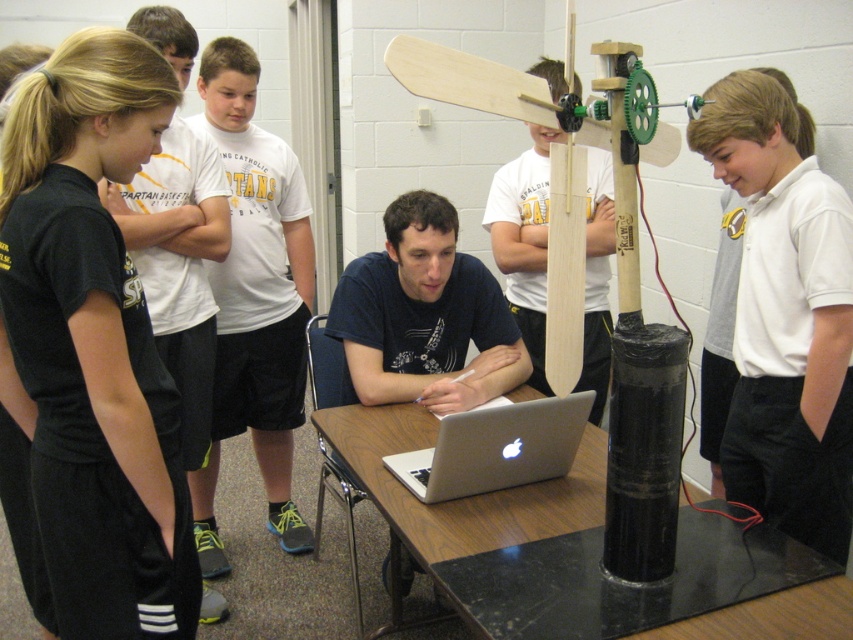
Is black marble table at center to the left of silver metallic laptop at center from the viewer's perspective?

In fact, black marble table at center is to the right of silver metallic laptop at center.

Between black marble table at center and silver metallic laptop at center, which one has more height?

black marble table at center is taller.

Is point (405, 435) more distant than point (537, 435)?

Yes.

Locate an element on the screen. The height and width of the screenshot is (640, 853). black marble table at center is located at coordinates (459, 499).

Which of these two, dark blue shirt at center or wooden propeller at center, stands shorter?

With less height is dark blue shirt at center.

Looking at this image, who is higher up, dark blue shirt at center or wooden propeller at center?

wooden propeller at center is higher up.

Between point (357, 356) and point (538, 193), which one is positioned in front?

Point (357, 356) is more forward.

Where is `dark blue shirt at center`? The width and height of the screenshot is (853, 640). dark blue shirt at center is located at coordinates (424, 316).

Which is more to the right, black fabric at left or dark blue shirt at center?

From the viewer's perspective, dark blue shirt at center appears more on the right side.

Is black fabric at left bigger than dark blue shirt at center?

Yes.

The height and width of the screenshot is (640, 853). Describe the element at coordinates (91, 342) in the screenshot. I see `black fabric at left` at that location.

Where is `black fabric at left`? Image resolution: width=853 pixels, height=640 pixels. black fabric at left is located at coordinates (91, 342).